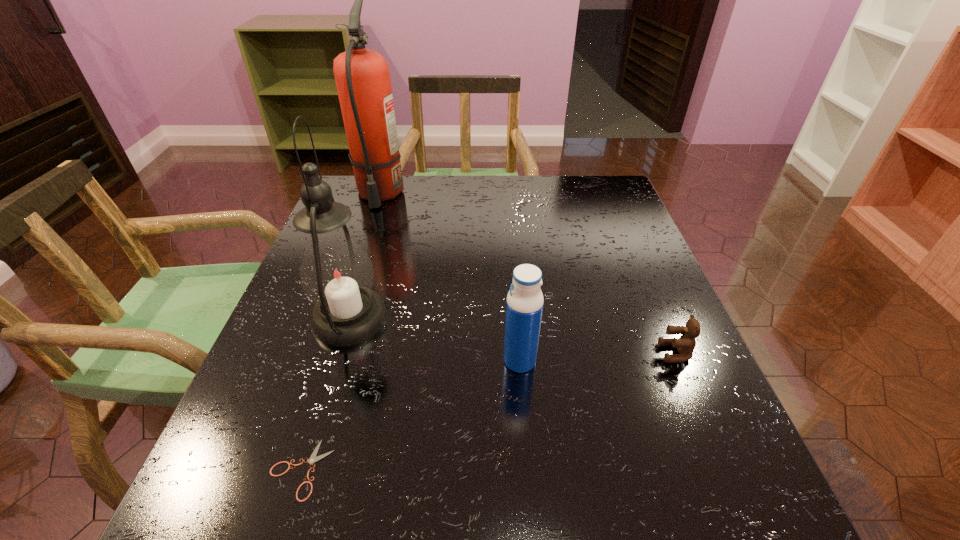
Where is `vacant area located 0.160m on the right of the fourth object from left to right`? The width and height of the screenshot is (960, 540). vacant area located 0.160m on the right of the fourth object from left to right is located at coordinates (623, 361).

Image resolution: width=960 pixels, height=540 pixels. I want to click on free location located on the face of the teddy bear, so click(x=629, y=353).

This screenshot has width=960, height=540. In order to click on free space located on the face of the teddy bear in this screenshot , I will do `click(505, 353)`.

You are a GUI agent. You are given a task and a screenshot of the screen. Output one action in this format:
    pyautogui.click(x=<x>, y=<y>)
    Task: Click on the vacant space located on the face of the teddy bear
    
    Given the screenshot: What is the action you would take?
    pyautogui.click(x=596, y=353)

This screenshot has height=540, width=960. Identify the location of free space located on the right of the shortest object. (518, 469).

Identify the location of object present at the far edge. This screenshot has height=540, width=960. (362, 76).

Where is `object located at the near edge`? object located at the near edge is located at coordinates (313, 458).

Find the location of a particular element. The image size is (960, 540). fire extinguisher positioned at the left edge is located at coordinates (362, 76).

Locate an element on the screen. oil lamp located at the left edge is located at coordinates (336, 273).

Locate an element on the screen. Image resolution: width=960 pixels, height=540 pixels. shears that is at the left edge is located at coordinates (313, 458).